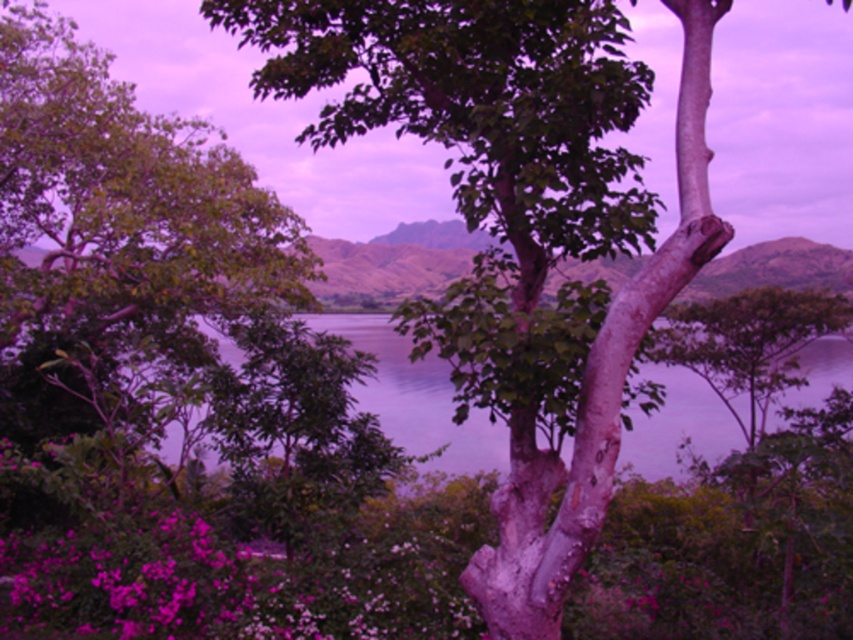
Is point (343, 547) closer to camera compared to point (813, 305)?

Yes.

Looking at this image, does pink matte flowers at lower left have a smaller size compared to smooth bark tree at center?

Yes, pink matte flowers at lower left is smaller than smooth bark tree at center.

Is point (134, 545) less distant than point (766, 388)?

That is True.

The width and height of the screenshot is (853, 640). Find the location of `pink matte flowers at lower left`. pink matte flowers at lower left is located at coordinates (235, 584).